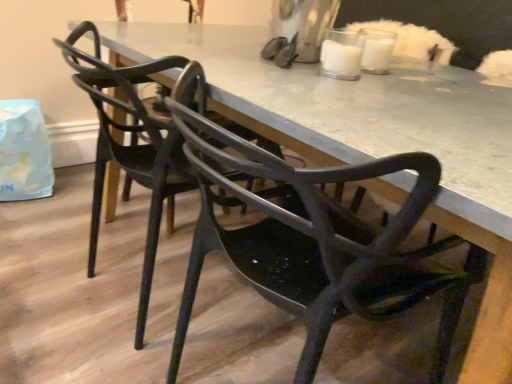
Question: In which direction should I rotate to look at matte black chair at center, acting as the 2th chair starting from the front?

Choices:
 (A) right
 (B) left

Answer: (B)

Question: Is matte black table at center in front of matte black chair at center, acting as the 2th chair starting from the front?

Choices:
 (A) yes
 (B) no

Answer: (A)

Question: Can you confirm if matte black table at center is shorter than matte black chair at center, placed as the 1th chair when sorted from back to front?

Choices:
 (A) yes
 (B) no

Answer: (A)

Question: From a real-world perspective, is matte black table at center below matte black chair at center, placed as the 1th chair when sorted from back to front?

Choices:
 (A) no
 (B) yes

Answer: (B)

Question: Considering the relative sizes of matte black table at center and matte black chair at center, placed as the 1th chair when sorted from back to front, in the image provided, is matte black table at center taller than matte black chair at center, placed as the 1th chair when sorted from back to front,?

Choices:
 (A) yes
 (B) no

Answer: (B)

Question: Is matte black table at center not inside matte black chair at center, placed as the 1th chair when sorted from back to front?

Choices:
 (A) yes
 (B) no

Answer: (A)

Question: Are matte black table at center and matte black chair at center, acting as the 2th chair starting from the front, far apart?

Choices:
 (A) no
 (B) yes

Answer: (A)

Question: From a real-world perspective, is matte black chair at center, arranged as the 2th chair when viewed from the back, located beneath matte black table at center?

Choices:
 (A) yes
 (B) no

Answer: (B)

Question: Is matte black chair at center, which is counted as the 1th chair, starting from the front, far from matte black table at center?

Choices:
 (A) yes
 (B) no

Answer: (B)

Question: Does matte black chair at center, which is counted as the 1th chair, starting from the front, have a larger size compared to matte black table at center?

Choices:
 (A) no
 (B) yes

Answer: (A)

Question: Considering the relative sizes of matte black chair at center, arranged as the 2th chair when viewed from the back, and matte black table at center in the image provided, is matte black chair at center, arranged as the 2th chair when viewed from the back, wider than matte black table at center?

Choices:
 (A) no
 (B) yes

Answer: (A)

Question: Is matte black table at center located within matte black chair at center, arranged as the 2th chair when viewed from the back?

Choices:
 (A) no
 (B) yes

Answer: (A)

Question: From the image's perspective, is matte black chair at center, which is counted as the 1th chair, starting from the front, beneath matte black table at center?

Choices:
 (A) no
 (B) yes

Answer: (B)

Question: Is matte black chair at center, arranged as the 2th chair when viewed from the back, facing away from matte black chair at center, acting as the 2th chair starting from the front?

Choices:
 (A) yes
 (B) no

Answer: (B)